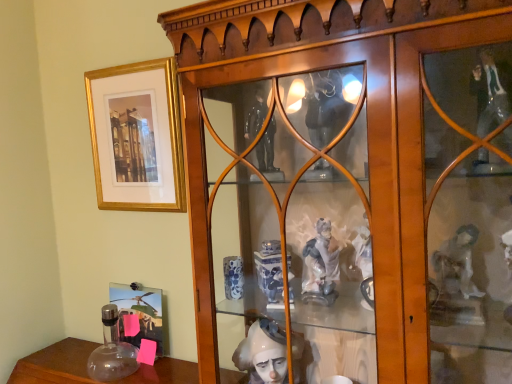
Question: From a real-world perspective, is gold/matte picture frame at upper left, acting as the second picture frame starting from the bottom, located higher than wooden cabinet at center?

Choices:
 (A) yes
 (B) no

Answer: (A)

Question: From the image's perspective, is gold/matte picture frame at upper left, which ranks as the first picture frame in top-to-bottom order, on wooden cabinet at center?

Choices:
 (A) yes
 (B) no

Answer: (A)

Question: Does gold/matte picture frame at upper left, acting as the second picture frame starting from the bottom, have a larger size compared to wooden cabinet at center?

Choices:
 (A) yes
 (B) no

Answer: (B)

Question: Is gold/matte picture frame at upper left, which ranks as the first picture frame in top-to-bottom order, aimed at wooden cabinet at center?

Choices:
 (A) no
 (B) yes

Answer: (A)

Question: Could wooden cabinet at center be considered to be inside gold/matte picture frame at upper left, acting as the second picture frame starting from the bottom?

Choices:
 (A) no
 (B) yes

Answer: (A)

Question: From a real-world perspective, is gold/matte picture frame at upper left, which ranks as the first picture frame in top-to-bottom order, below wooden cabinet at center?

Choices:
 (A) yes
 (B) no

Answer: (B)

Question: From the image's perspective, does wooden cabinet at center appear higher than gold/matte picture frame at upper left, acting as the second picture frame starting from the bottom?

Choices:
 (A) yes
 (B) no

Answer: (B)

Question: Would you say gold/matte picture frame at upper left, which ranks as the first picture frame in top-to-bottom order, is part of wooden cabinet at center's contents?

Choices:
 (A) no
 (B) yes

Answer: (A)

Question: Considering the relative positions of wooden cabinet at center and gold/matte picture frame at upper left, which ranks as the first picture frame in top-to-bottom order, in the image provided, is wooden cabinet at center to the right of gold/matte picture frame at upper left, which ranks as the first picture frame in top-to-bottom order, from the viewer's perspective?

Choices:
 (A) yes
 (B) no

Answer: (A)

Question: Is wooden cabinet at center outside of gold/matte picture frame at upper left, which ranks as the first picture frame in top-to-bottom order?

Choices:
 (A) yes
 (B) no

Answer: (A)

Question: Is wooden cabinet at center turned away from gold/matte picture frame at upper left, acting as the second picture frame starting from the bottom?

Choices:
 (A) yes
 (B) no

Answer: (B)

Question: From a real-world perspective, is wooden cabinet at center positioned under gold/matte picture frame at upper left, which ranks as the first picture frame in top-to-bottom order, based on gravity?

Choices:
 (A) no
 (B) yes

Answer: (B)

Question: From the image's perspective, does metallic silver photo frame at lower left, the first picture frame when ordered from bottom to top, appear higher than wooden cabinet at center?

Choices:
 (A) no
 (B) yes

Answer: (A)